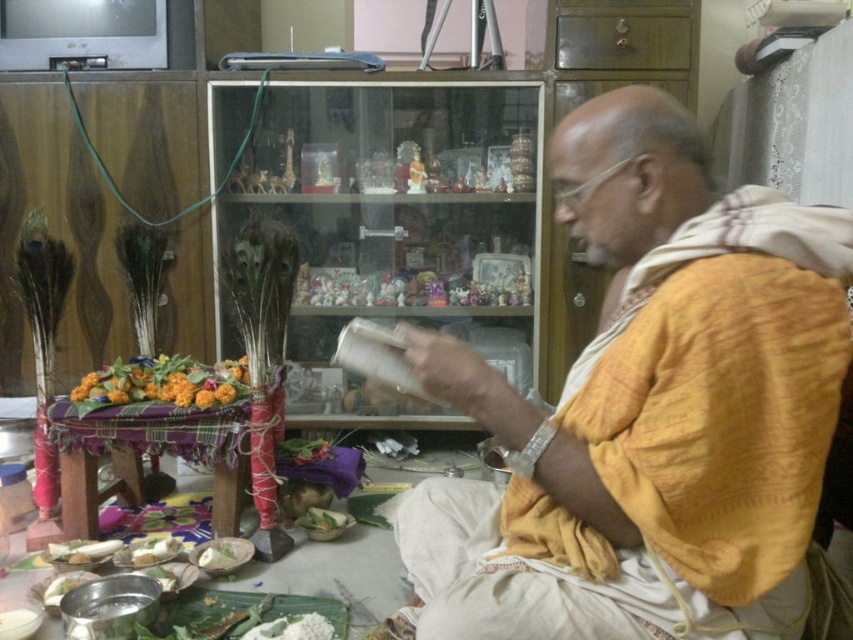
Is floral bouquet at center to the left of white matte rice at lower center from the viewer's perspective?

Indeed, floral bouquet at center is positioned on the left side of white matte rice at lower center.

This screenshot has width=853, height=640. I want to click on floral bouquet at center, so click(x=161, y=381).

Between point (85, 394) and point (236, 564), which one is positioned in front?

Point (236, 564)

The height and width of the screenshot is (640, 853). In order to click on floral bouquet at center in this screenshot , I will do `click(161, 381)`.

Does point (672, 147) come closer to viewer compared to point (67, 563)?

Yes, it is.

Can you confirm if yellow cotton cloth at center is smaller than white matte plate at lower left?

Incorrect, yellow cotton cloth at center is not smaller in size than white matte plate at lower left.

This screenshot has height=640, width=853. Find the location of `yellow cotton cloth at center`. yellow cotton cloth at center is located at coordinates (648, 412).

Is yellow cotton cloth at center closer to camera compared to white matte rice at lower center?

Yes.

Describe the element at coordinates (648, 412) in the screenshot. Image resolution: width=853 pixels, height=640 pixels. I see `yellow cotton cloth at center` at that location.

Where is `yellow cotton cloth at center`? The height and width of the screenshot is (640, 853). yellow cotton cloth at center is located at coordinates (648, 412).